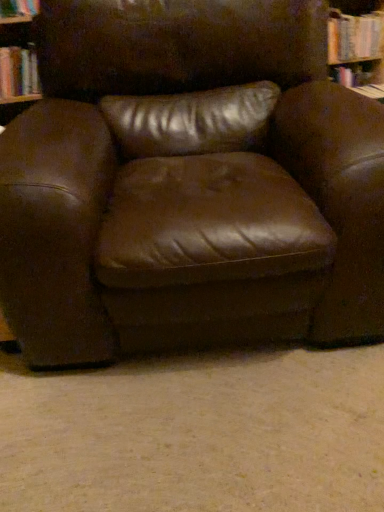
Question: Is hardcover book at upper left facing towards brown leather chair at center?

Choices:
 (A) yes
 (B) no

Answer: (A)

Question: Is hardcover book at upper left looking in the opposite direction of brown leather chair at center?

Choices:
 (A) yes
 (B) no

Answer: (B)

Question: Is hardcover book at upper left in front of brown leather chair at center?

Choices:
 (A) yes
 (B) no

Answer: (B)

Question: From a real-world perspective, is hardcover book at upper left beneath brown leather chair at center?

Choices:
 (A) yes
 (B) no

Answer: (B)

Question: Does hardcover book at upper left have a lesser height compared to brown leather chair at center?

Choices:
 (A) yes
 (B) no

Answer: (A)

Question: Can brown leather chair at center be found inside hardcover book at upper left?

Choices:
 (A) no
 (B) yes

Answer: (A)

Question: Is brown leather chair at center to the left of hardcover book at upper left from the viewer's perspective?

Choices:
 (A) no
 (B) yes

Answer: (A)

Question: From the image's perspective, is brown leather chair at center under hardcover book at upper left?

Choices:
 (A) no
 (B) yes

Answer: (B)

Question: Is brown leather chair at center closer to camera compared to hardcover book at upper left?

Choices:
 (A) yes
 (B) no

Answer: (A)

Question: From the image's perspective, is brown leather chair at center on hardcover book at upper left?

Choices:
 (A) yes
 (B) no

Answer: (B)

Question: Is the position of brown leather chair at center more distant than that of hardcover book at upper left?

Choices:
 (A) yes
 (B) no

Answer: (B)

Question: Is brown leather chair at center positioned with its back to hardcover book at upper left?

Choices:
 (A) no
 (B) yes

Answer: (A)

Question: Relative to hardcover book at upper left, is brown leather chair at center in front or behind?

Choices:
 (A) behind
 (B) front

Answer: (B)